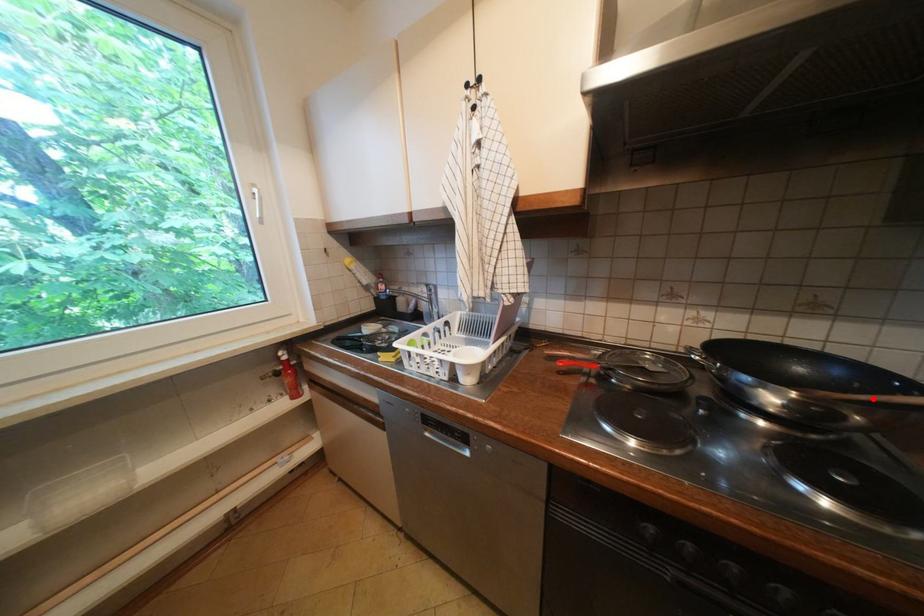
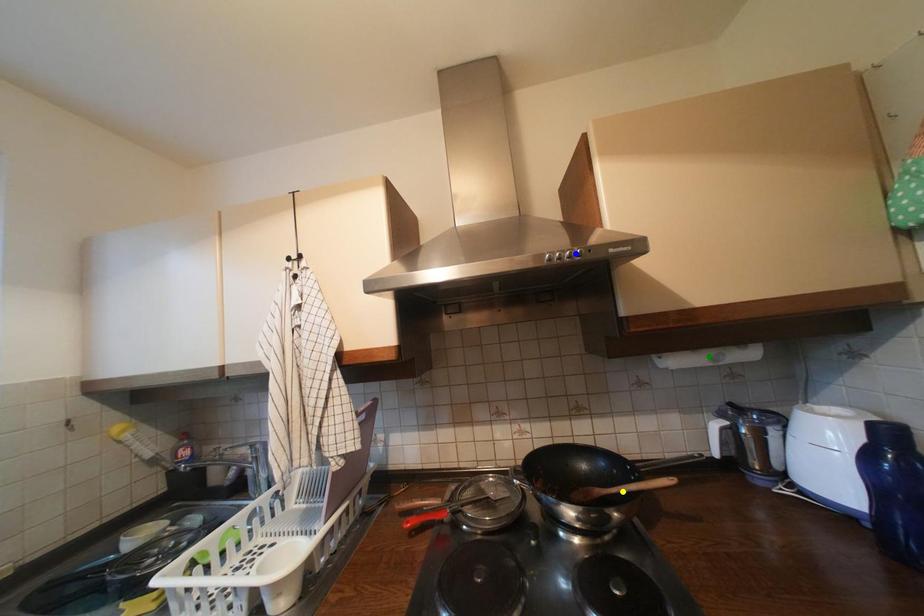
Question: I am providing you with two images of the same scene from different viewpoints. A red point is marked on the first image. You are given multiple points on the second image. Which point in image 2 represents the same 3d spot as the red point in image 1?

Choices:
 (A) yellow point
 (B) blue point
 (C) green point

Answer: (A)